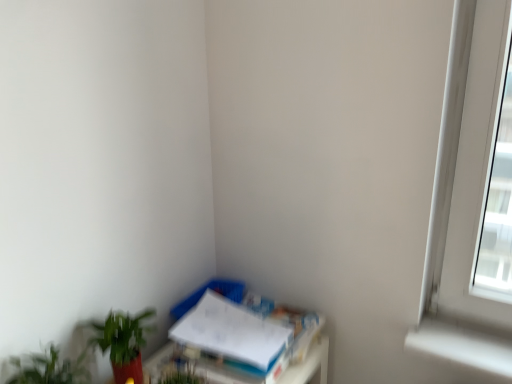
Question: Could you tell me if white paper at lower right is facing green matte plant at lower left, which appears as the first houseplant when viewed from the back?

Choices:
 (A) yes
 (B) no

Answer: (B)

Question: Is white paper at lower right outside green matte plant at lower left, which is the 2th houseplant in front-to-back order?

Choices:
 (A) no
 (B) yes

Answer: (B)

Question: Is white paper at lower right turned away from green matte plant at lower left, which appears as the first houseplant when viewed from the back?

Choices:
 (A) yes
 (B) no

Answer: (B)

Question: From a real-world perspective, is white paper at lower right positioned over green matte plant at lower left, which appears as the first houseplant when viewed from the back, based on gravity?

Choices:
 (A) yes
 (B) no

Answer: (B)

Question: Can you see white paper at lower right touching green matte plant at lower left, which is the 2th houseplant in front-to-back order?

Choices:
 (A) yes
 (B) no

Answer: (B)

Question: In the image, is green matte plant at lower left, which appears as the first houseplant when viewed from the back, positioned in front of or behind white paper at lower right?

Choices:
 (A) front
 (B) behind

Answer: (A)

Question: Is green matte plant at lower left, which appears as the first houseplant when viewed from the back, to the left or to the right of white paper at lower right in the image?

Choices:
 (A) left
 (B) right

Answer: (A)

Question: From a real-world perspective, relative to white paper at lower right, is green matte plant at lower left, which is the 2th houseplant in front-to-back order, vertically above or below?

Choices:
 (A) below
 (B) above

Answer: (B)

Question: Is green matte plant at lower left, which appears as the first houseplant when viewed from the back, bigger or smaller than white paper at lower right?

Choices:
 (A) big
 (B) small

Answer: (B)

Question: In terms of height, does green leafy plant at lower left, acting as the second houseplant starting from the back, look taller or shorter compared to white paper at lower right?

Choices:
 (A) short
 (B) tall

Answer: (B)

Question: Is green leafy plant at lower left, acting as the 1th houseplant starting from the front, in front of or behind white paper at lower right in the image?

Choices:
 (A) behind
 (B) front

Answer: (B)

Question: In the image, is green leafy plant at lower left, acting as the 1th houseplant starting from the front, on the left side or the right side of white paper at lower right?

Choices:
 (A) left
 (B) right

Answer: (A)

Question: From the image's perspective, is green leafy plant at lower left, acting as the 1th houseplant starting from the front, located above or below white paper at lower right?

Choices:
 (A) below
 (B) above

Answer: (B)

Question: Based on their positions, is green leafy plant at lower left, acting as the second houseplant starting from the back, located to the left or right of green matte plant at lower left, which appears as the first houseplant when viewed from the back?

Choices:
 (A) left
 (B) right

Answer: (A)

Question: Is point (34, 375) positioned closer to the camera than point (145, 316)?

Choices:
 (A) closer
 (B) farther

Answer: (A)